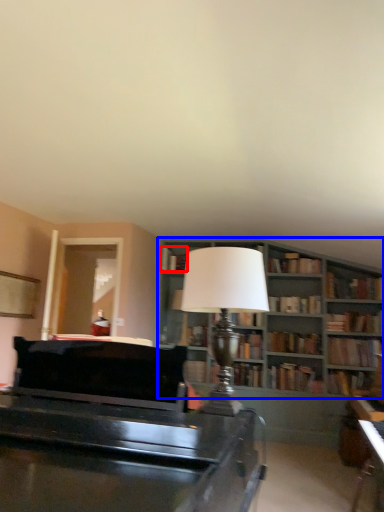
Question: Which point is further to the camera, book (highlighted by a red box) or bookcase (highlighted by a blue box)?

Choices:
 (A) book
 (B) bookcase

Answer: (A)